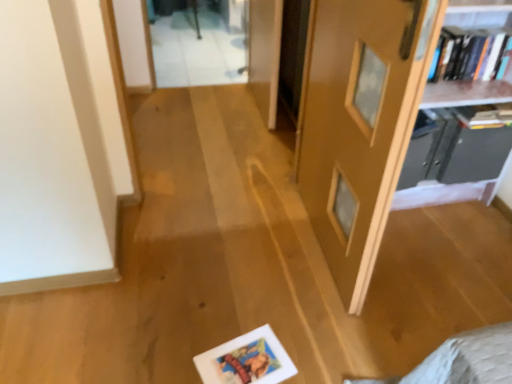
In order to click on vacant region in front of matte wooden door at center in this screenshot , I will do `click(311, 320)`.